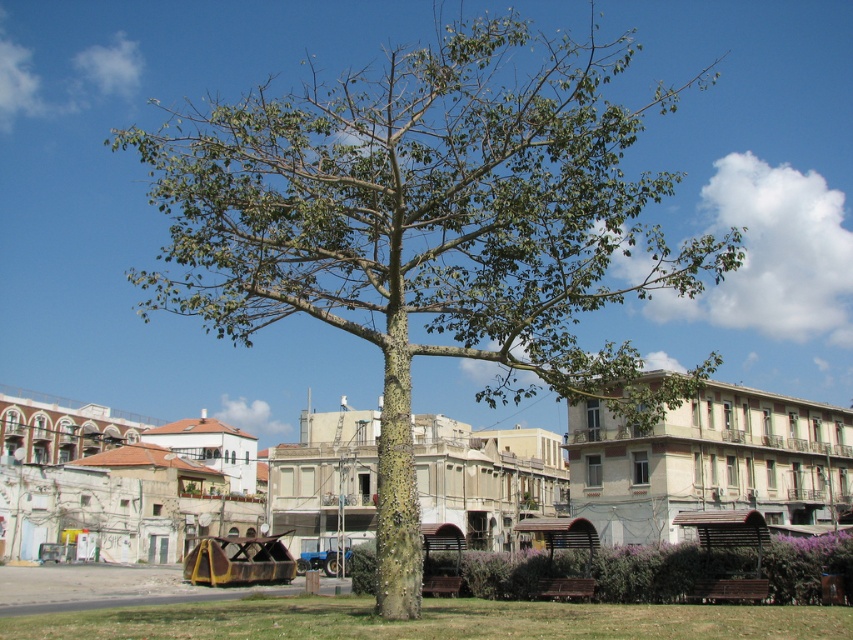
This screenshot has height=640, width=853. Describe the element at coordinates (428, 228) in the screenshot. I see `green rough bark tree at center` at that location.

Does green rough bark tree at center have a greater width compared to green rough tree at center?

Correct, the width of green rough bark tree at center exceeds that of green rough tree at center.

You are a GUI agent. You are given a task and a screenshot of the screen. Output one action in this format:
    pyautogui.click(x=<x>, y=<y>)
    Task: Click on the green rough bark tree at center
    
    Given the screenshot: What is the action you would take?
    pyautogui.click(x=428, y=228)